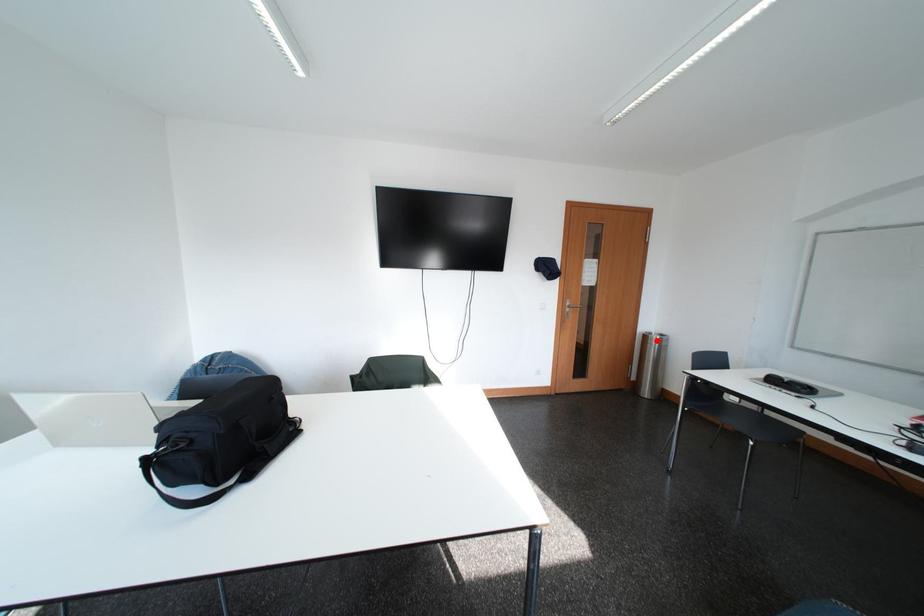
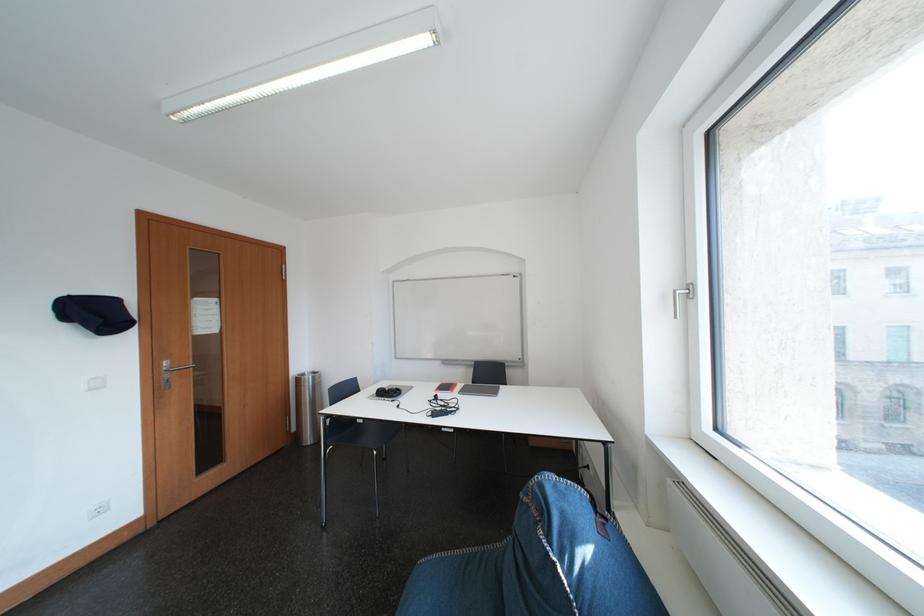
The point at the highlighted location is marked in the first image. Where is the corresponding point in the second image?

(310, 383)